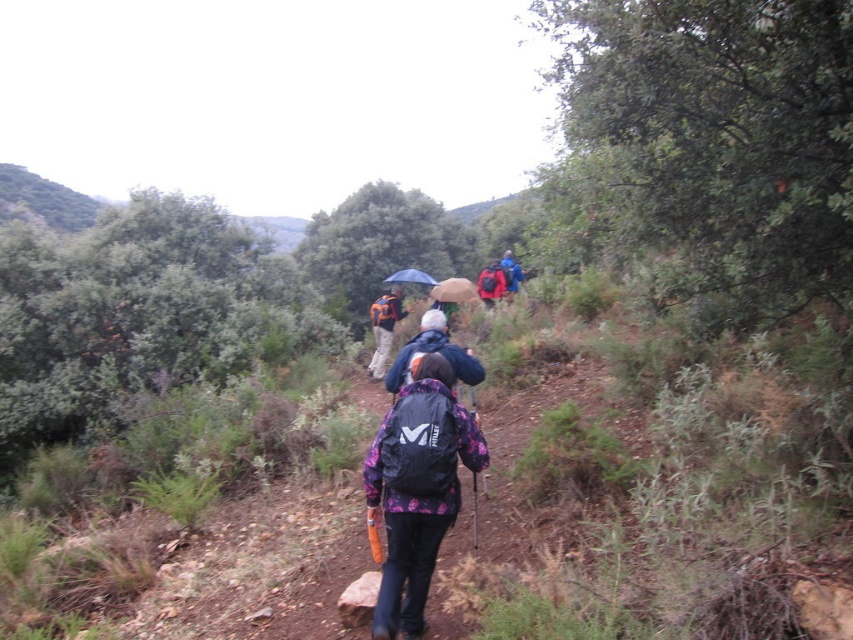
You are a hiker carrying a blue fabric backpack at center and holding a blue fabric umbrella at center. You want to take a photo of the surrounding forest without any obstruction. Which item should you remove or adjust to ensure a clear view?

The blue fabric umbrella at center has a lesser height compared to the blue fabric backpack at center. To ensure a clear view of the surrounding forest, you should adjust or remove the blue fabric umbrella at center since it is shorter and might block your line of sight when holding it.

You are a hiker on the trail and notice two items at the center of your view. Which item is positioned to the left when looking at the orange fabric backpack at center and the blue matte umbrella at center?

The orange fabric backpack at center is positioned to the left of the blue matte umbrella at center.